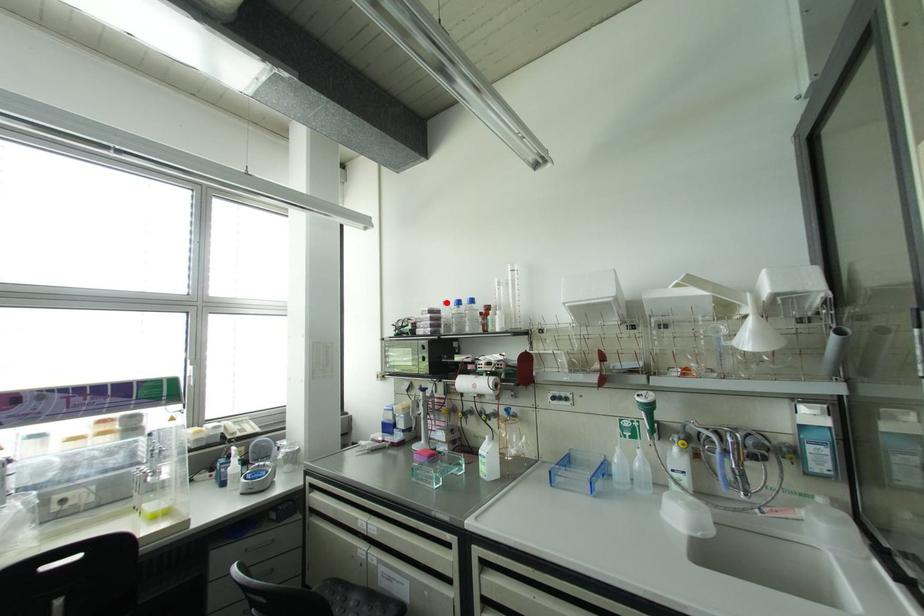
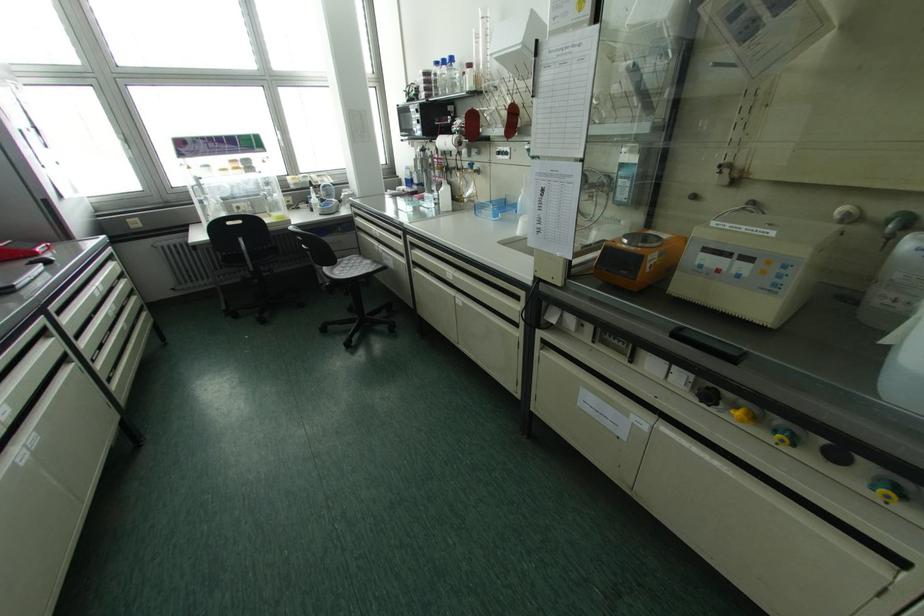
In the second image, find the point that corresponds to the highlighted location in the first image.

(435, 63)